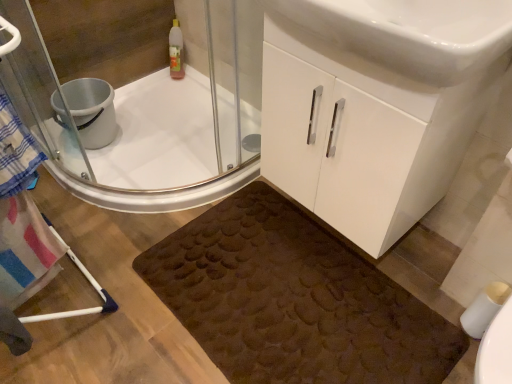
Where is `free spot to the right of silver metallic bucket at upper left`? This screenshot has height=384, width=512. free spot to the right of silver metallic bucket at upper left is located at coordinates (148, 135).